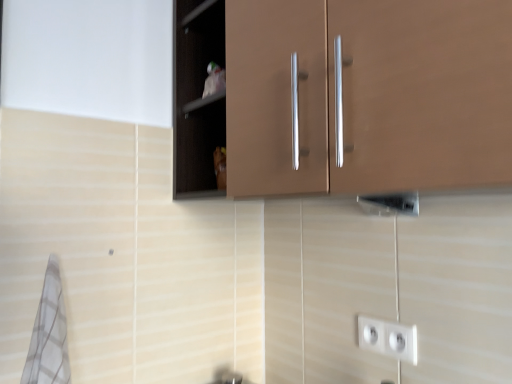
Question: Is white plastic socket at lower right bigger or smaller than brown matte cabinet at center, the 2th cabinetry from the front?

Choices:
 (A) small
 (B) big

Answer: (A)

Question: Relative to brown matte cabinet at center, the 2th cabinetry from the front, is white plastic socket at lower right in front or behind?

Choices:
 (A) front
 (B) behind

Answer: (A)

Question: Estimate the real-world distances between objects in this image. Which object is farther from the brown matte cabinet at center, the 2th cabinetry from the front?

Choices:
 (A) white plastic socket at lower right
 (B) matte brown cabinet at upper center, arranged as the second cabinetry when viewed from the back
 (C) white checkered bath towel at lower left

Answer: (C)

Question: Considering the real-world distances, which object is closest to the matte brown cabinet at upper center, arranged as the second cabinetry when viewed from the back?

Choices:
 (A) brown matte cabinet at center, which is the first cabinetry from back to front
 (B) white checkered bath towel at lower left
 (C) white plastic socket at lower right

Answer: (A)